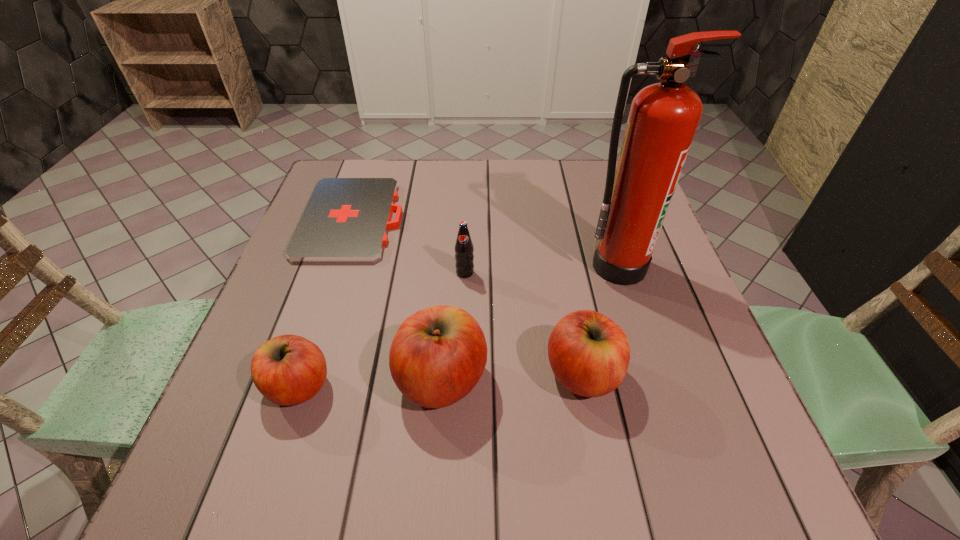
With all apples evenly spaced, where should an extra apple be placed on the right to continue the pattern? Please point out a vacant space. Please provide its 2D coordinates. Your answer should be formatted as a tuple, i.e. [(x, y)], where the tuple contains the x and y coordinates of a point satisfying the conditions above.

[(719, 368)]